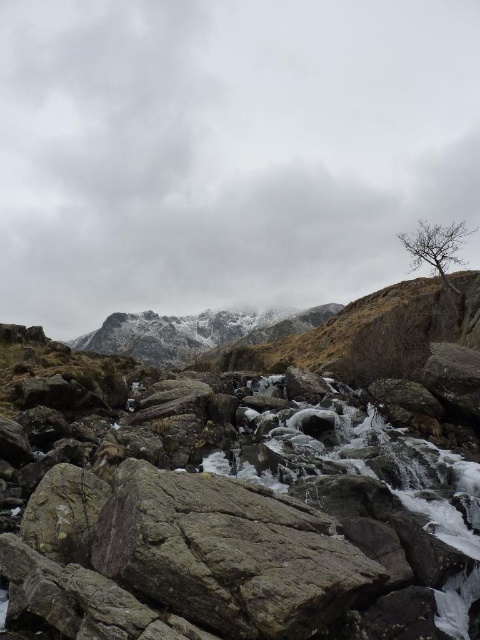
You are standing at the base of the waterfall in this rugged landscape. You notice two points marked in the scene. Which of the two points, point (336,566) or point (403,241), is closer to your current position?

Point (336,566) is closer to the viewer than point (403,241).

You are a hiker who wants to cross the rocky terrain to reach the mountain peaks. You notice the gray rough rock at center and the bare branches at upper right. How far apart are these two landmarks?

The gray rough rock at center and the bare branches at upper right are 237.55 feet apart from each other.